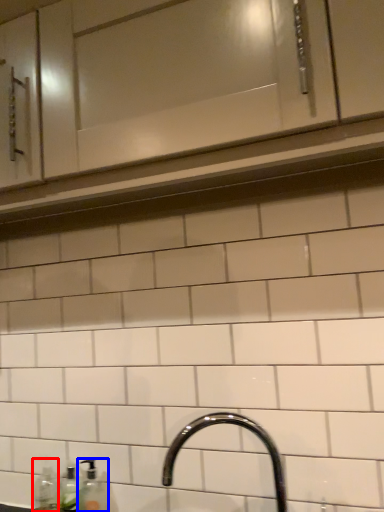
Question: Which point is further to the camera, bottle (highlighted by a red box) or soap dispenser (highlighted by a blue box)?

Choices:
 (A) bottle
 (B) soap dispenser

Answer: (A)